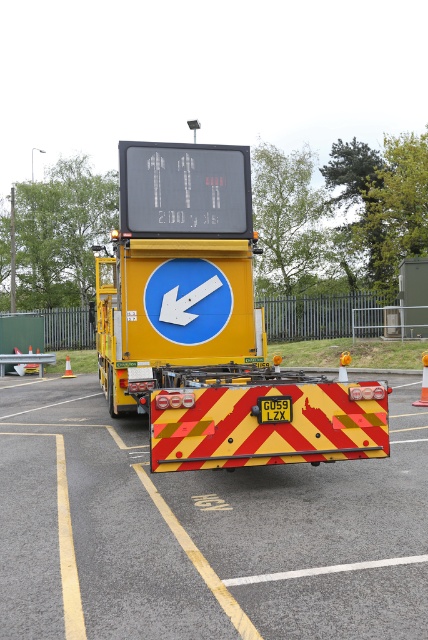
Can you confirm if yellow reflective plastic trailer at center is wider than orange plastic traffic cone at lower left?

Yes, yellow reflective plastic trailer at center is wider than orange plastic traffic cone at lower left.

Between yellow reflective plastic trailer at center and orange plastic traffic cone at lower left, which one has more height?

yellow reflective plastic trailer at center is taller.

In order to click on yellow reflective plastic trailer at center in this screenshot , I will do `click(210, 324)`.

Is point (415, 401) closer to camera compared to point (27, 364)?

Yes, point (415, 401) is in front of point (27, 364).

Could you measure the distance between orange plastic traffic cone at lower right and orange plastic traffic cone at left?

A distance of 56.44 feet exists between orange plastic traffic cone at lower right and orange plastic traffic cone at left.

Consider the image. Who is more forward, [427,381] or [30,368]?

Positioned in front is point [427,381].

The width and height of the screenshot is (428, 640). In order to click on orange plastic traffic cone at lower right in this screenshot , I will do `click(422, 381)`.

Who is positioned more to the right, yellow reflective plastic at center or orange plastic traffic cone at lower right?

From the viewer's perspective, orange plastic traffic cone at lower right appears more on the right side.

Can you confirm if yellow reflective plastic at center is positioned to the left of orange plastic traffic cone at lower right?

Indeed, yellow reflective plastic at center is positioned on the left side of orange plastic traffic cone at lower right.

Which is behind, point (360, 467) or point (422, 362)?

The point (422, 362) is behind.

You are a GUI agent. You are given a task and a screenshot of the screen. Output one action in this format:
    pyautogui.click(x=<x>, y=<y>)
    Task: Click on the yellow reflective plastic at center
    
    Given the screenshot: What is the action you would take?
    pyautogui.click(x=202, y=532)